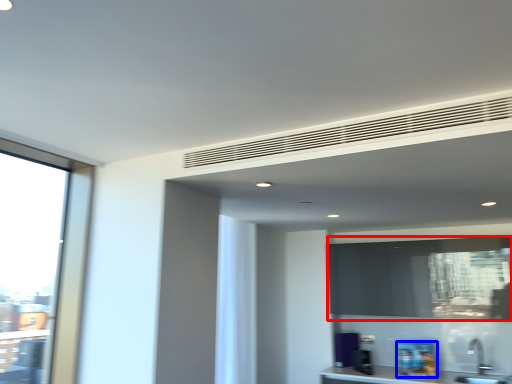
Question: Among these objects, which one is nearest to the camera, window screen (highlighted by a red box) or appliance (highlighted by a blue box)?

Choices:
 (A) window screen
 (B) appliance

Answer: (A)